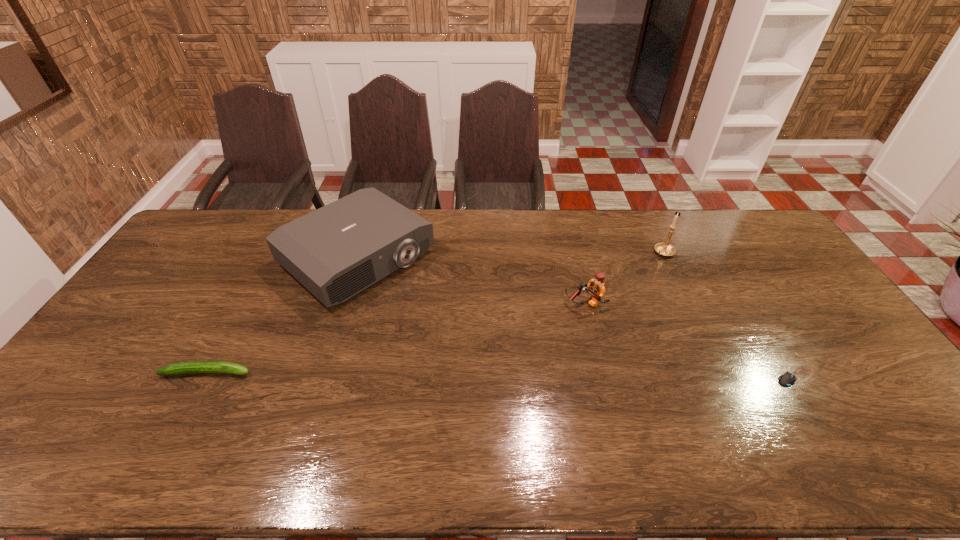
Find the location of `free space between the projector and the candle holder`. free space between the projector and the candle holder is located at coordinates (511, 255).

Where is `free space between the projector and the Lego`? Image resolution: width=960 pixels, height=540 pixels. free space between the projector and the Lego is located at coordinates (471, 281).

Where is `vacant point located between the projector and the Lego`? Image resolution: width=960 pixels, height=540 pixels. vacant point located between the projector and the Lego is located at coordinates (471, 281).

This screenshot has width=960, height=540. I want to click on vacant space that's between the mouse and the projector, so click(577, 318).

You are a GUI agent. You are given a task and a screenshot of the screen. Output one action in this format:
    pyautogui.click(x=<x>, y=<y>)
    Task: Click on the vacant space that's between the projector and the fourth tallest object
    The height and width of the screenshot is (540, 960).
    Given the screenshot: What is the action you would take?
    pyautogui.click(x=282, y=315)

Find the location of `vacant space that's between the third object from left to right and the projector`. vacant space that's between the third object from left to right and the projector is located at coordinates (471, 281).

Find the location of a particular element. free spot between the projector and the second shortest object is located at coordinates (282, 315).

The image size is (960, 540). I want to click on object that stands as the second closest to the fourth object from left to right, so click(x=787, y=379).

Identify the location of object that is the fourth closest one to the projector. The width and height of the screenshot is (960, 540). (787, 379).